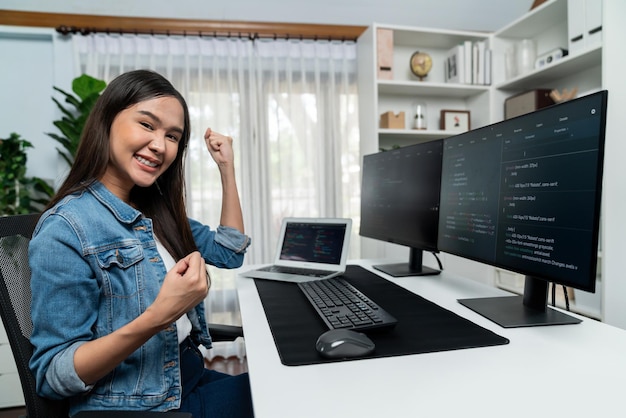
Locate an element on the screen. The height and width of the screenshot is (418, 626). computer mouse is located at coordinates (336, 341).